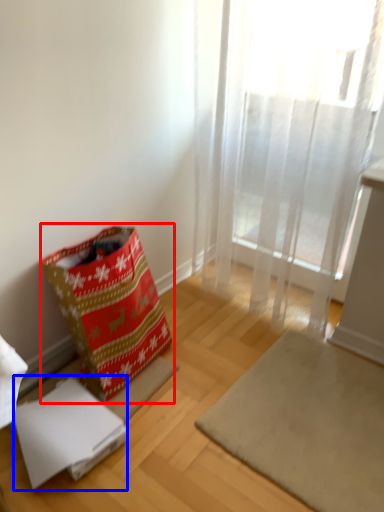
Question: Among these objects, which one is nearest to the camera, gift bag (highlighted by a red box) or cardboard box (highlighted by a blue box)?

Choices:
 (A) gift bag
 (B) cardboard box

Answer: (A)